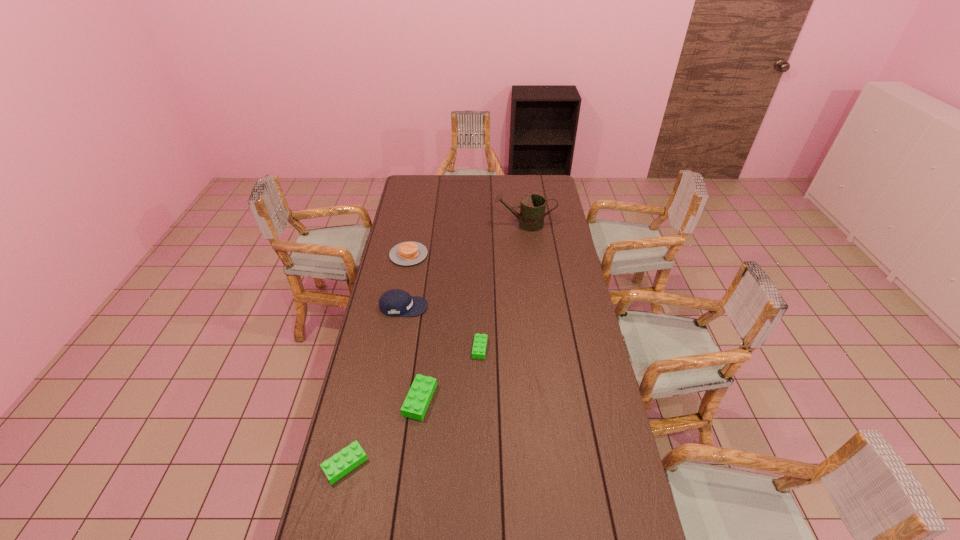
Identify which Lego is the third nearest to the pancake. Please provide its 2D coordinates. Your answer should be formatted as a tuple, i.e. [(x, y)], where the tuple contains the x and y coordinates of a point satisfying the conditions above.

[(341, 463)]

The height and width of the screenshot is (540, 960). In order to click on free space in the image that satisfies the following two spatial constraints: 1. on the back side of the shortest object; 2. on the front-facing side of the fourth nearest object in this screenshot , I will do `click(480, 307)`.

Where is `vacant space that satisfies the following two spatial constraints: 1. on the front-facing side of the baseball cap; 2. on the right side of the second Lego from right to left`? This screenshot has height=540, width=960. vacant space that satisfies the following two spatial constraints: 1. on the front-facing side of the baseball cap; 2. on the right side of the second Lego from right to left is located at coordinates click(387, 400).

What are the coordinates of `vacant space that satisfies the following two spatial constraints: 1. on the front-facing side of the baseball cap; 2. on the left side of the rightmost Lego` in the screenshot? It's located at (396, 348).